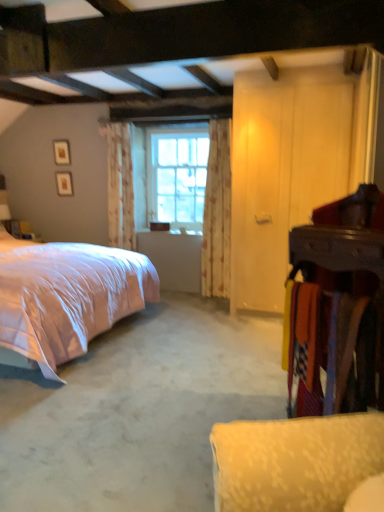
The image size is (384, 512). Find the location of `blank area beneath floral fabric curtain at center, placed as the 2th curtain when sorted from left to right (from a real-world perspective)`. blank area beneath floral fabric curtain at center, placed as the 2th curtain when sorted from left to right (from a real-world perspective) is located at coordinates (211, 296).